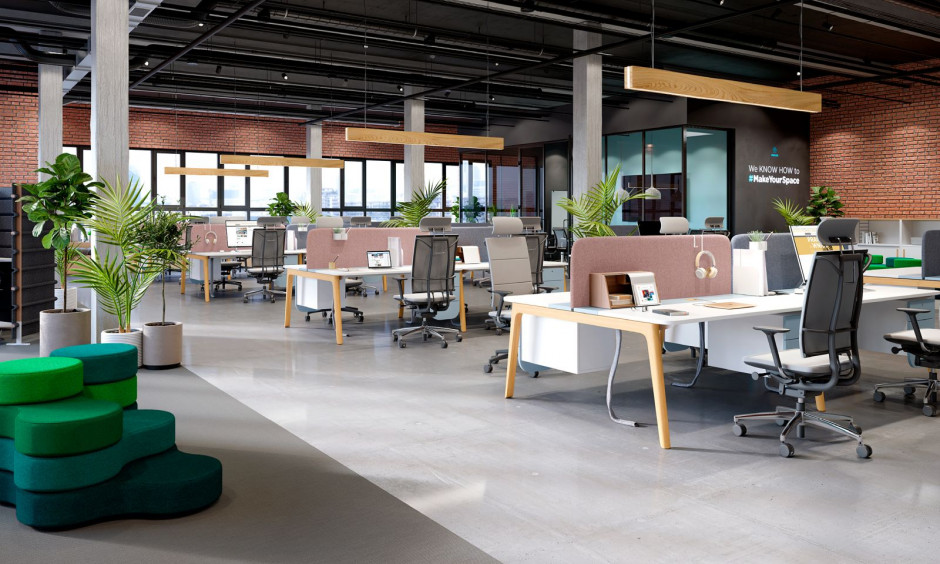
The width and height of the screenshot is (940, 564). What are the coordinates of `support beams` in the screenshot? It's located at (578, 173), (411, 160), (309, 188), (103, 176), (48, 140).